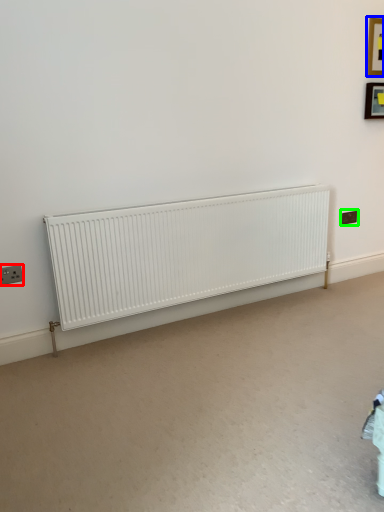
Question: Considering the real-world distances, which object is closest to electric outlet (highlighted by a red box)? picture frame (highlighted by a blue box) or electric outlet (highlighted by a green box).

Choices:
 (A) picture frame
 (B) electric outlet

Answer: (B)